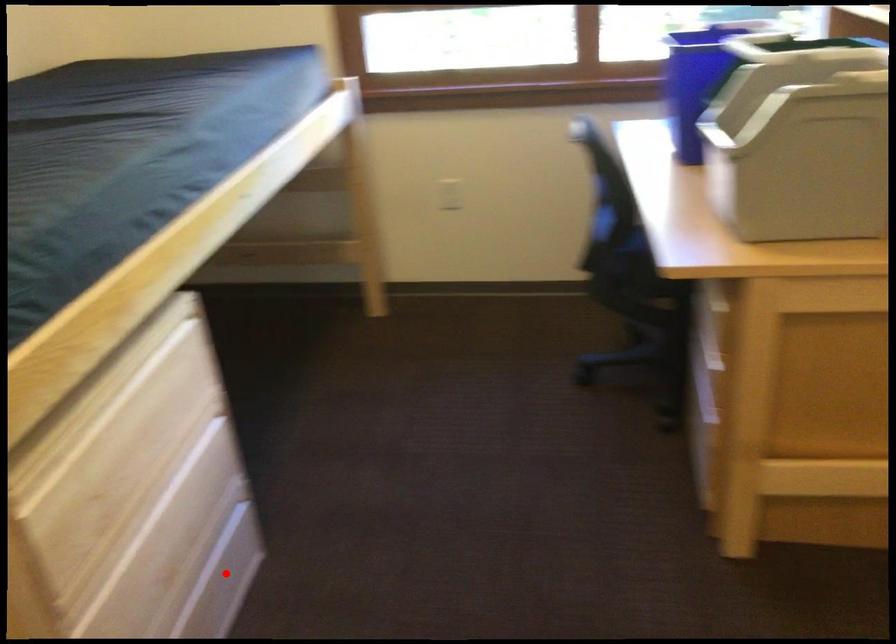
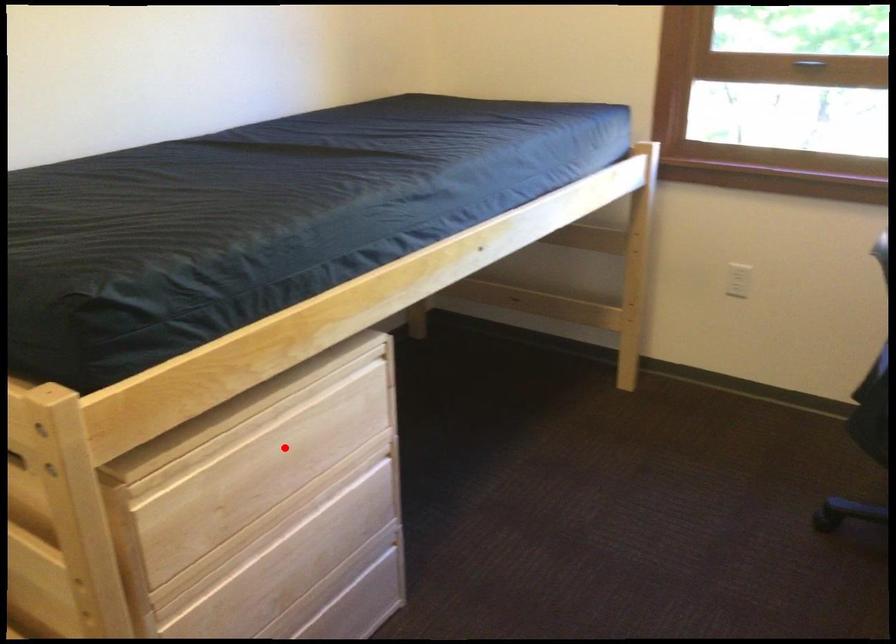
I am providing you with two images of the same scene from different viewpoints. A red point is marked on the first image and another point is marked on the second image. Does the point marked in image1 correspond to the same location as the one in image2?

No